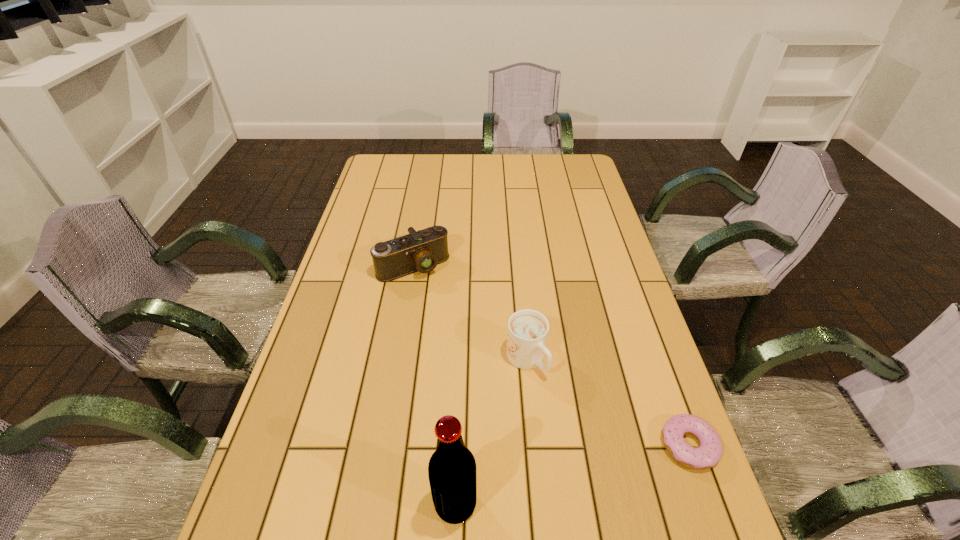
Locate an element on the screen. The height and width of the screenshot is (540, 960). the nearest object is located at coordinates (452, 467).

Where is `the third object from right to left`? the third object from right to left is located at coordinates (452, 467).

Identify the location of doughnut. (708, 454).

What are the coordinates of `the shortest object` in the screenshot? It's located at (708, 454).

At what (x,y) coordinates should I click in order to perform the action: click on cappuccino. Please return your answer as a coordinate pair (x, y). Looking at the image, I should click on (x=528, y=329).

Locate an element on the screen. The height and width of the screenshot is (540, 960). the third nearest object is located at coordinates (528, 329).

At what (x,y) coordinates should I click in order to perform the action: click on the leftmost object. Please return your answer as a coordinate pair (x, y). Looking at the image, I should click on (422, 250).

The width and height of the screenshot is (960, 540). I want to click on the farthest object, so [422, 250].

This screenshot has width=960, height=540. Find the location of `free region located 0.130m on the right of the nearest object`. free region located 0.130m on the right of the nearest object is located at coordinates (543, 504).

Identify the location of vacant region located on the left of the doughnut. This screenshot has width=960, height=540. (474, 445).